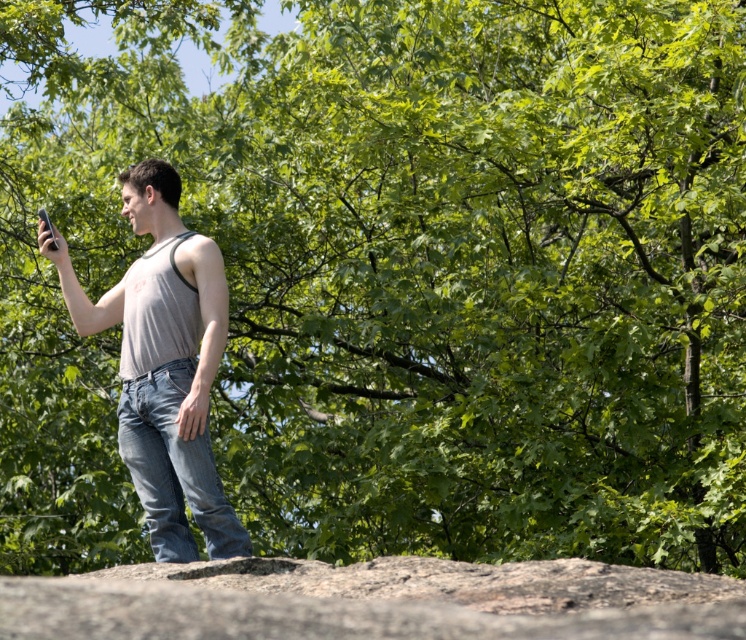
Looking at this image, can you confirm if smooth gray rock at center is shorter than matte black phone at upper left?

No, smooth gray rock at center is not shorter than matte black phone at upper left.

Does smooth gray rock at center appear over matte black phone at upper left?

Incorrect, smooth gray rock at center is not positioned above matte black phone at upper left.

Between point (54, 612) and point (51, 234), which one is positioned in front?

Point (54, 612) is more forward.

Locate an element on the screen. smooth gray rock at center is located at coordinates (373, 600).

Locate an element on the screen. The width and height of the screenshot is (746, 640). smooth gray rock at center is located at coordinates click(x=373, y=600).

Is gray cotton tank top at center closer to the viewer compared to matte black phone at upper left?

Yes, gray cotton tank top at center is closer to the viewer.

Looking at this image, can you confirm if gray cotton tank top at center is shorter than matte black phone at upper left?

Incorrect, gray cotton tank top at center's height does not fall short of matte black phone at upper left's.

The width and height of the screenshot is (746, 640). In order to click on gray cotton tank top at center in this screenshot , I will do `click(163, 364)`.